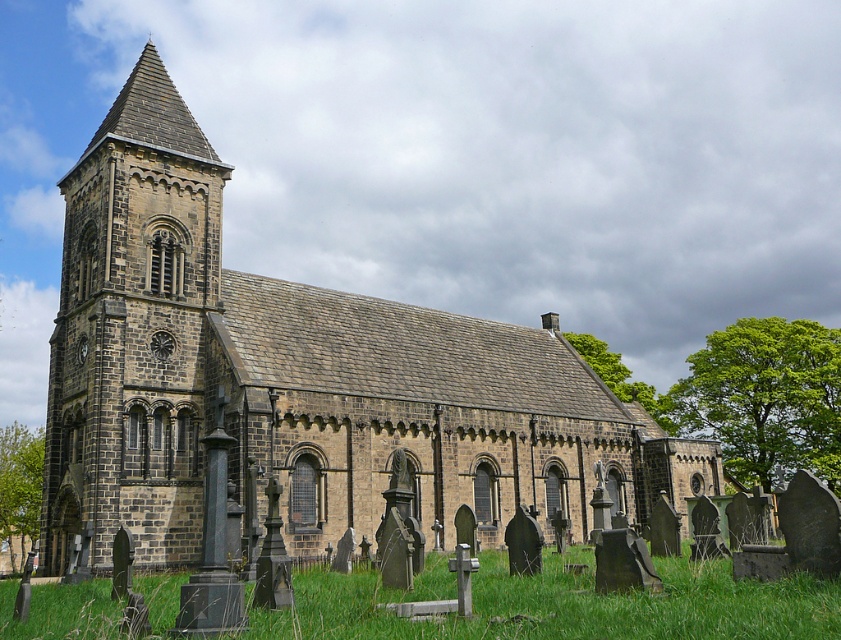
Can you confirm if dark gray stone tower at left is bigger than green grass at lower center?

Yes, dark gray stone tower at left is bigger than green grass at lower center.

Is dark gray stone tower at left closer to camera compared to green grass at lower center?

No.

The height and width of the screenshot is (640, 841). Find the location of `dark gray stone tower at left`. dark gray stone tower at left is located at coordinates (131, 330).

Find the location of a particular element. The height and width of the screenshot is (640, 841). dark gray stone tower at left is located at coordinates (131, 330).

Does brown stone church at center appear on the right side of green grass at lower center?

Yes, brown stone church at center is to the right of green grass at lower center.

Image resolution: width=841 pixels, height=640 pixels. What do you see at coordinates (295, 378) in the screenshot?
I see `brown stone church at center` at bounding box center [295, 378].

At what (x,y) coordinates should I click in order to perform the action: click on brown stone church at center. Please return your answer as a coordinate pair (x, y). Looking at the image, I should click on (295, 378).

Between brown stone church at center and dark gray stone tower at left, which one appears on the left side from the viewer's perspective?

dark gray stone tower at left

How much distance is there between brown stone church at center and dark gray stone tower at left?

brown stone church at center is 12.74 meters from dark gray stone tower at left.

Is point (149, 305) positioned behind point (151, 212)?

No, (149, 305) is closer to viewer.

At what (x,y) coordinates should I click in order to perform the action: click on brown stone church at center. Please return your answer as a coordinate pair (x, y). The width and height of the screenshot is (841, 640). Looking at the image, I should click on tap(295, 378).